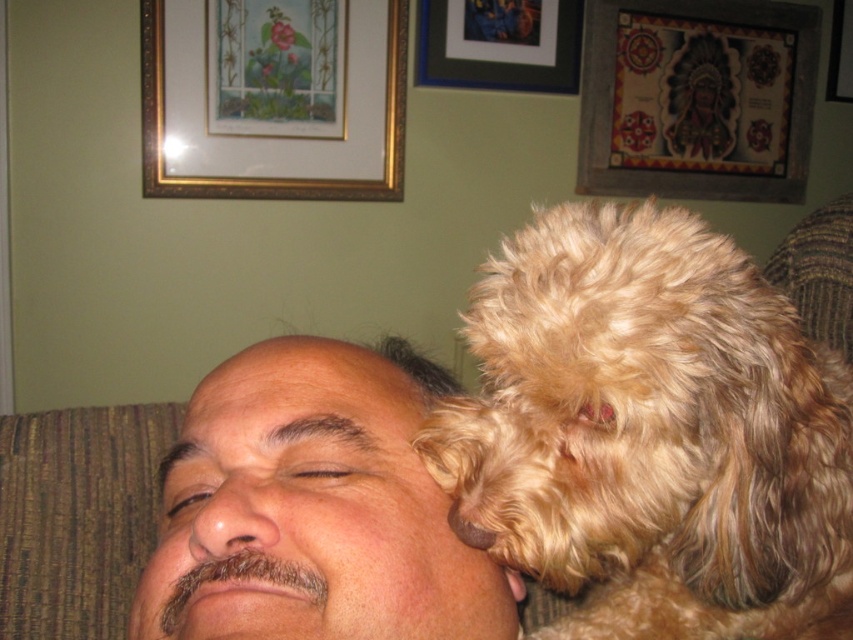
Question: Is brown skin at center behind matte black picture frame at upper center?

Choices:
 (A) no
 (B) yes

Answer: (A)

Question: Does fuzzy golden dog at upper right have a larger size compared to matte black picture frame at upper center?

Choices:
 (A) yes
 (B) no

Answer: (A)

Question: Which point appears closest to the camera in this image?

Choices:
 (A) (590, 220)
 (B) (325, 467)
 (C) (428, 77)
 (D) (750, 124)

Answer: (A)

Question: Is fuzzy golden dog at upper right below brown skin at center?

Choices:
 (A) no
 (B) yes

Answer: (A)

Question: Among these objects, which one is farthest from the camera?

Choices:
 (A) matte black picture frame at upper center
 (B) wooden framed artwork at upper right
 (C) fuzzy golden dog at upper right
 (D) gold-framed picture at upper left

Answer: (B)

Question: Which point is farther from the camera taking this photo?

Choices:
 (A) (511, 598)
 (B) (704, 371)
 (C) (253, 502)
 (D) (160, 193)

Answer: (D)